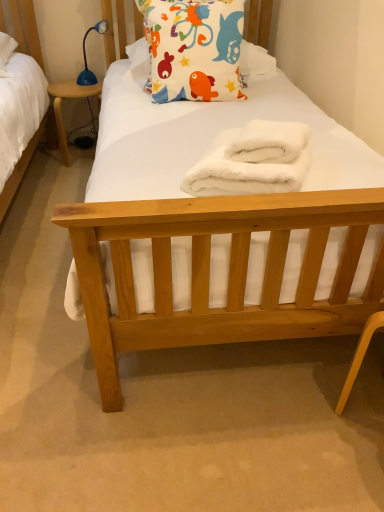
Identify the location of empty space that is ontop of white fluffy bath towel at center (from a real-world perspective). Image resolution: width=384 pixels, height=512 pixels. (273, 129).